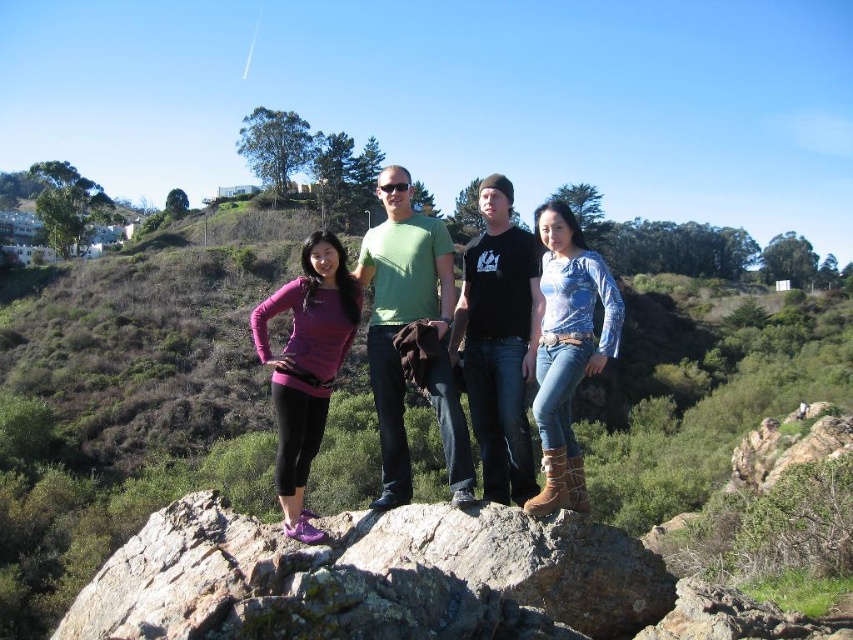
Does green grassy hillside at center have a greater width compared to matte green t-shirt at center?

Yes.

Who is lower down, green grassy hillside at center or matte green t-shirt at center?

Positioned lower is matte green t-shirt at center.

Where is `green grassy hillside at center`? Image resolution: width=853 pixels, height=640 pixels. green grassy hillside at center is located at coordinates (123, 406).

Image resolution: width=853 pixels, height=640 pixels. I want to click on green grassy hillside at center, so pos(123,406).

Is green grassy hillside at center above blue denim jeans at center?

Yes.

Where is `green grassy hillside at center`? The height and width of the screenshot is (640, 853). green grassy hillside at center is located at coordinates (123, 406).

The height and width of the screenshot is (640, 853). Identify the location of green grassy hillside at center. (123, 406).

Is point (376, 180) positioned before point (393, 403)?

No, it is not.

Does matte green t-shirt at center lie behind green matte t-shirt at center?

No, matte green t-shirt at center is in front of green matte t-shirt at center.

Is point (425, 371) less distant than point (383, 380)?

Yes, it is.

Identify the location of matte green t-shirt at center. The image size is (853, 640). (410, 323).